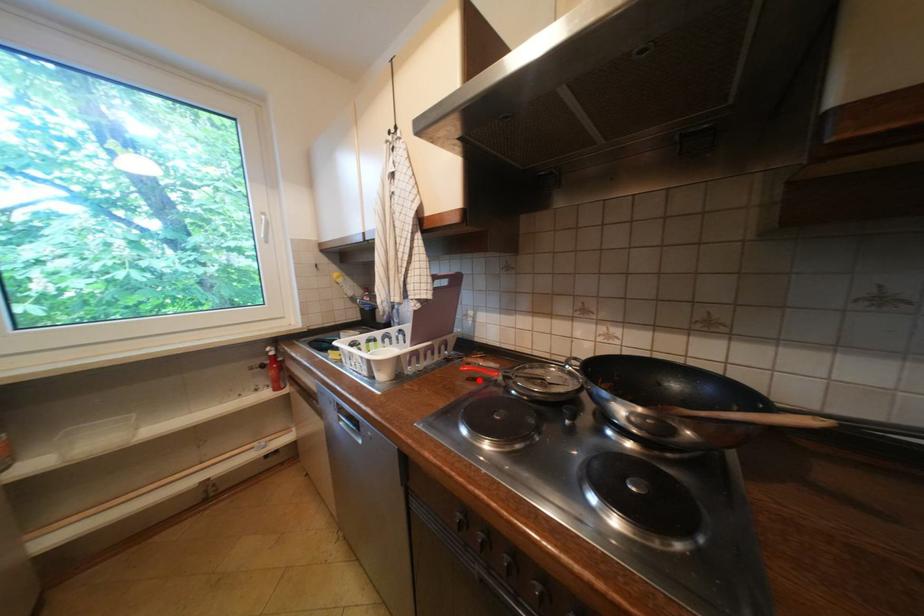
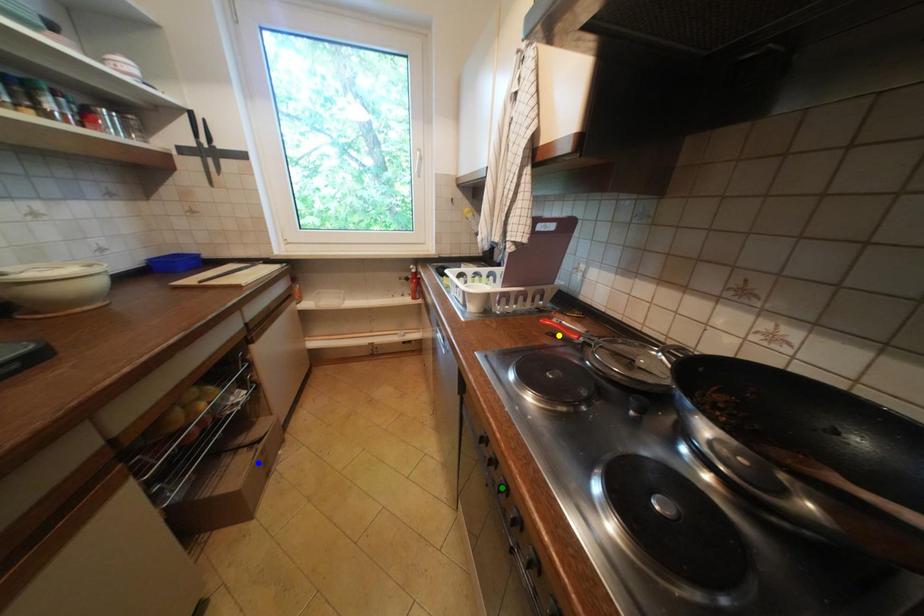
Question: I am providing you with two images of the same scene from different viewpoints. A red point is marked on the first image. You are given multiple points on the second image. In image 2, which mark is for the same physical point as the one in image 1?

Choices:
 (A) yellow point
 (B) blue point
 (C) green point

Answer: (A)